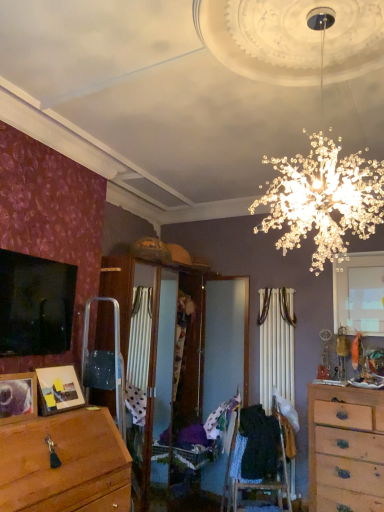
Question: Is white matte window at upper right at the right side of patterned fabric at center, which is counted as the first clothing, starting from the left?

Choices:
 (A) no
 (B) yes

Answer: (B)

Question: Is white matte window at upper right shorter than patterned fabric at center, which is counted as the first clothing, starting from the left?

Choices:
 (A) no
 (B) yes

Answer: (A)

Question: Are white matte window at upper right and patterned fabric at center, acting as the second clothing starting from the right, beside each other?

Choices:
 (A) yes
 (B) no

Answer: (B)

Question: From a real-world perspective, is white matte window at upper right over patterned fabric at center, acting as the second clothing starting from the right?

Choices:
 (A) no
 (B) yes

Answer: (B)

Question: Is white matte window at upper right facing away from patterned fabric at center, which is counted as the first clothing, starting from the left?

Choices:
 (A) no
 (B) yes

Answer: (A)

Question: Based on their positions, is wooden chest of drawers at right located to the left or right of patterned fabric at center, acting as the second clothing starting from the right?

Choices:
 (A) left
 (B) right

Answer: (B)

Question: From a real-world perspective, is wooden chest of drawers at right physically located above or below patterned fabric at center, which is counted as the first clothing, starting from the left?

Choices:
 (A) above
 (B) below

Answer: (B)

Question: Is point (332, 480) closer or farther from the camera than point (226, 400)?

Choices:
 (A) closer
 (B) farther

Answer: (A)

Question: From the image's perspective, is wooden chest of drawers at right located above or below patterned fabric at center, which is counted as the first clothing, starting from the left?

Choices:
 (A) above
 (B) below

Answer: (B)

Question: Is wooden photo frame at lower left taller or shorter than black fabric at center, which is the second clothing from left to right?

Choices:
 (A) tall
 (B) short

Answer: (B)

Question: Do you think wooden photo frame at lower left is within black fabric at center, which is the second clothing from left to right, or outside of it?

Choices:
 (A) inside
 (B) outside

Answer: (B)

Question: From the image's perspective, is wooden photo frame at lower left located above or below black fabric at center, marked as the 1th clothing in a right-to-left arrangement?

Choices:
 (A) above
 (B) below

Answer: (A)

Question: Considering the positions of wooden photo frame at lower left and black fabric at center, which is the second clothing from left to right, in the image, is wooden photo frame at lower left wider or thinner than black fabric at center, which is the second clothing from left to right,?

Choices:
 (A) wide
 (B) thin

Answer: (B)

Question: Visually, is wooden photo frame at lower left positioned to the left or to the right of patterned fabric at center, which is counted as the first clothing, starting from the left?

Choices:
 (A) right
 (B) left

Answer: (B)

Question: In terms of height, does wooden photo frame at lower left look taller or shorter compared to patterned fabric at center, acting as the second clothing starting from the right?

Choices:
 (A) tall
 (B) short

Answer: (B)